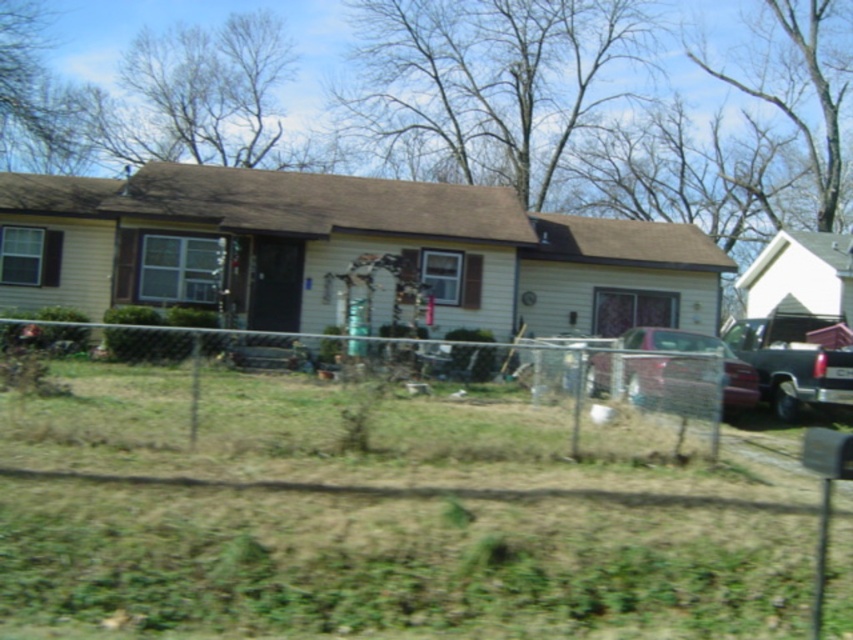
Question: Is green grass at lower center thinner than metallic dark gray truck at right?

Choices:
 (A) yes
 (B) no

Answer: (B)

Question: Considering the real-world distances, which object is closest to the wire mesh fence at center?

Choices:
 (A) metallic dark gray truck at right
 (B) green grass at lower center

Answer: (B)

Question: Which of these objects is positioned farthest from the metallic maroon sedan at center?

Choices:
 (A) metallic dark gray truck at right
 (B) wire mesh fence at center
 (C) green grass at lower center

Answer: (B)

Question: Where is green grass at lower center located in relation to metallic maroon sedan at center in the image?

Choices:
 (A) left
 (B) right

Answer: (A)

Question: Is the position of green grass at lower center less distant than that of metallic dark gray truck at right?

Choices:
 (A) yes
 (B) no

Answer: (A)

Question: Which object appears farthest from the camera in this image?

Choices:
 (A) metallic dark gray truck at right
 (B) metallic maroon sedan at center
 (C) green grass at lower center
 (D) wire mesh fence at center

Answer: (A)